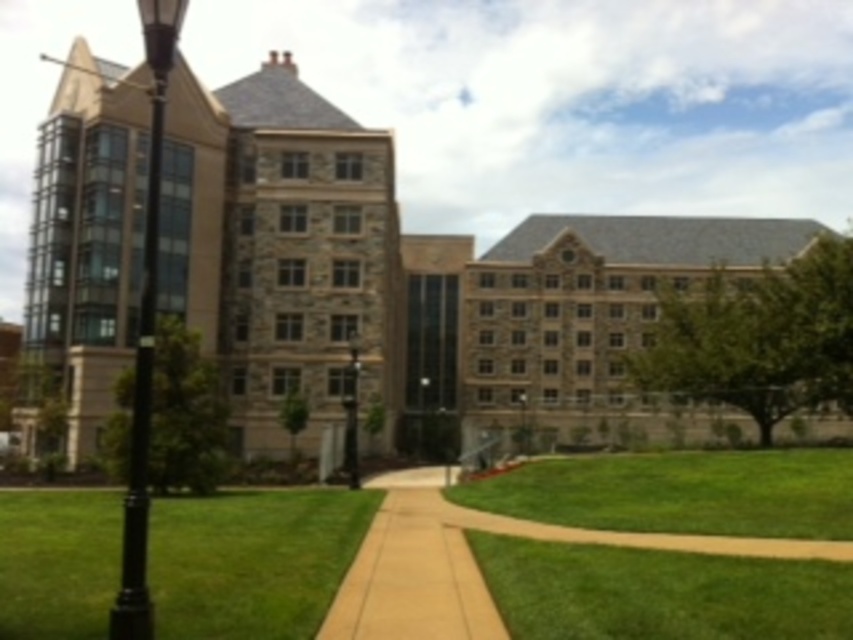
Between black polished metal lamp post at left and black metal lamp post at center, which one is positioned lower?

black metal lamp post at center

Based on the photo, who is shorter, black polished metal lamp post at left or black metal lamp post at center?

Standing shorter between the two is black metal lamp post at center.

Locate an element on the screen. This screenshot has height=640, width=853. black polished metal lamp post at left is located at coordinates (144, 337).

Between beige concrete sidewalk at center and black metal lamp post at center, which one appears on the left side from the viewer's perspective?

From the viewer's perspective, black metal lamp post at center appears more on the left side.

Does point (370, 624) come in front of point (351, 403)?

Yes, point (370, 624) is closer to viewer.

Between point (459, 557) and point (351, 472), which one is positioned behind?

The point (351, 472) is behind.

Locate an element on the screen. Image resolution: width=853 pixels, height=640 pixels. beige concrete sidewalk at center is located at coordinates (412, 572).

Which is in front, point (283, 552) or point (138, 624)?

Point (138, 624)

Between green grass at lower left and black polished metal lamp post at left, which one is positioned higher?

black polished metal lamp post at left is higher up.

Does point (80, 509) come in front of point (140, 365)?

That is False.

Identify the location of green grass at lower left. (252, 561).